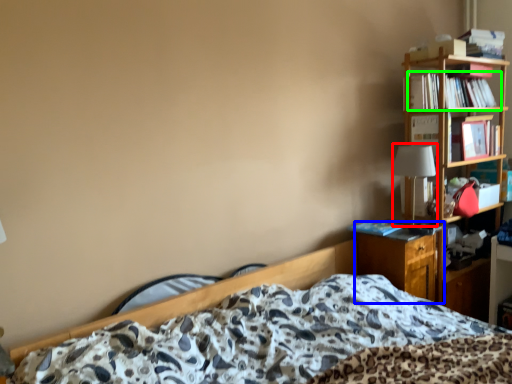
Question: Based on their relative distances, which object is nearer to table lamp (highlighted by a red box)? Choose from nightstand (highlighted by a blue box) and book (highlighted by a green box).

Choices:
 (A) nightstand
 (B) book

Answer: (A)